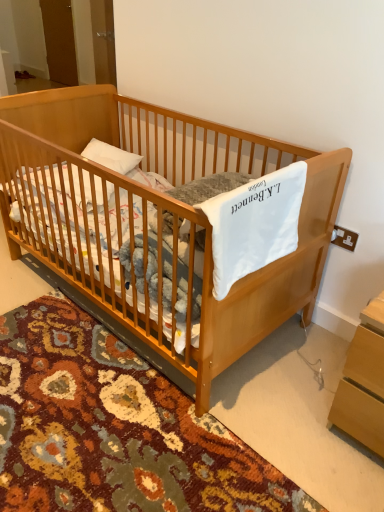
Where is `free space to the back side of light brown wooden changing table at lower right`? The image size is (384, 512). free space to the back side of light brown wooden changing table at lower right is located at coordinates (315, 345).